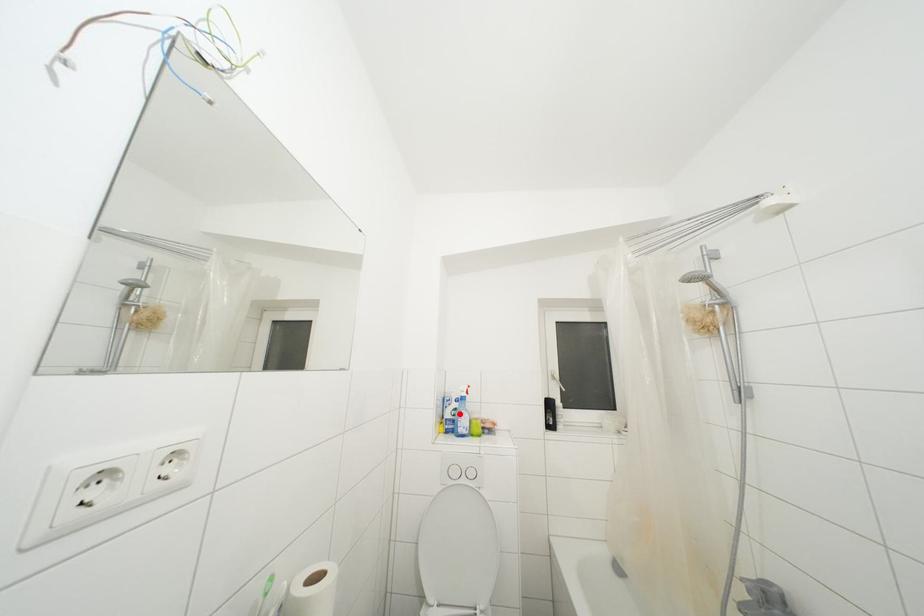
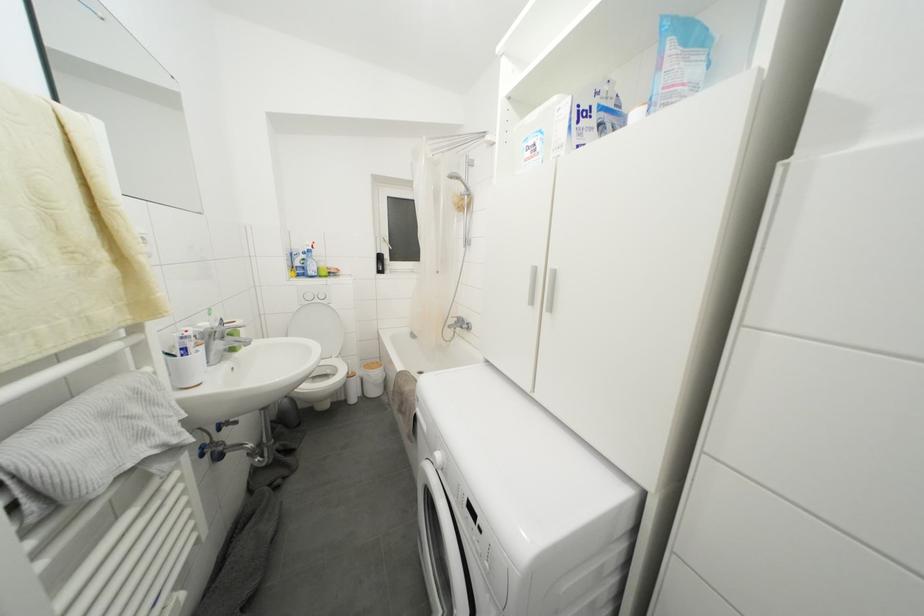
Locate, in the second image, the point that corresponds to the highlighted location in the first image.

(308, 264)